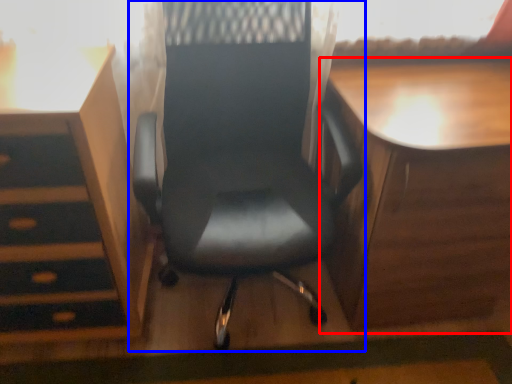
Question: Which object appears farthest to the camera in this image, table (highlighted by a red box) or chair (highlighted by a blue box)?

Choices:
 (A) table
 (B) chair

Answer: (A)